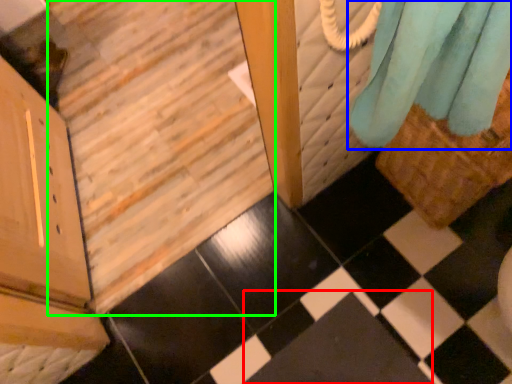
Question: Considering the real-world distances, which object is closest to square (highlighted by a red box)? curtain (highlighted by a blue box) or stairwell (highlighted by a green box).

Choices:
 (A) curtain
 (B) stairwell

Answer: (A)